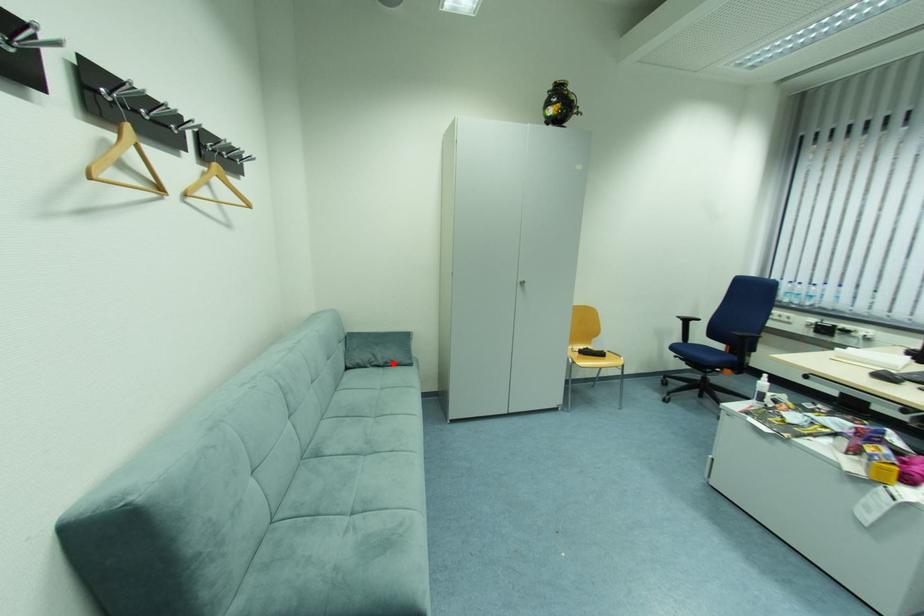
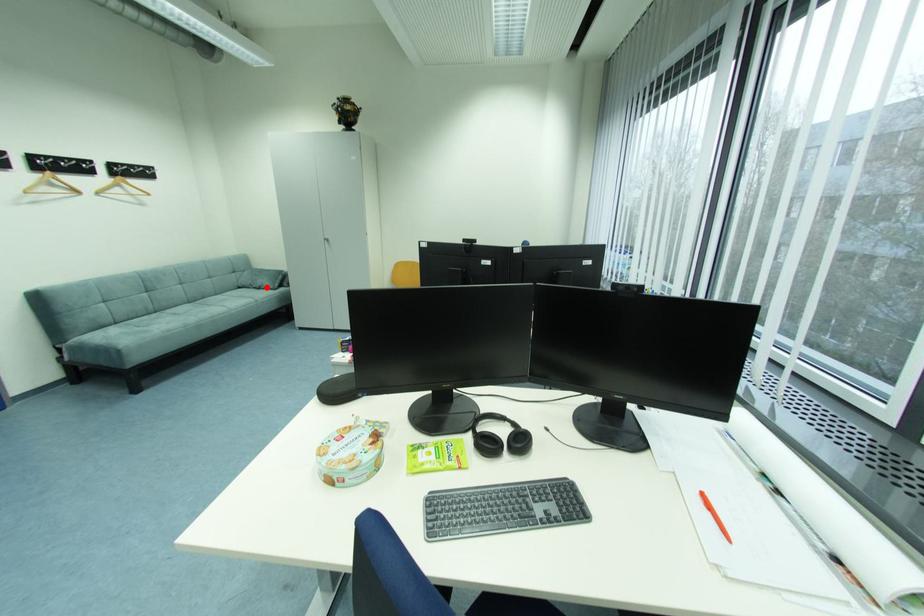
I am providing you with two images of the same scene from different viewpoints. A red point is marked on the first image and another point is marked on the second image. Do the highlighted points in image1 and image2 indicate the same real-world spot?

Yes